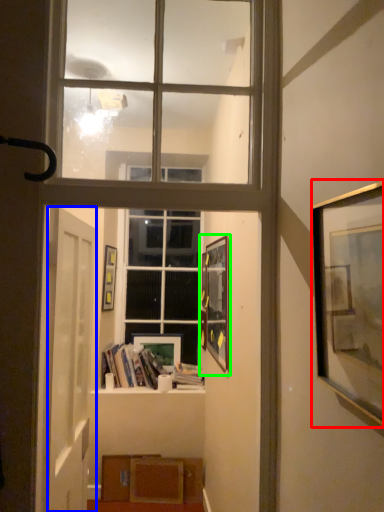
Question: Based on their relative distances, which object is nearer to picture frame (highlighted by a red box)? Choose from door (highlighted by a blue box) and picture frame (highlighted by a green box).

Choices:
 (A) door
 (B) picture frame

Answer: (A)